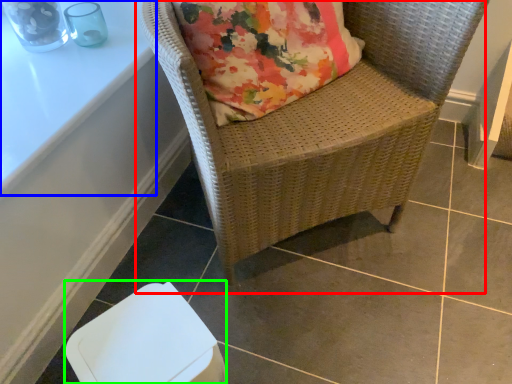
Question: Considering the real-world distances, which object is farthest from chair (highlighted by a red box)? table (highlighted by a blue box) or swivel chair (highlighted by a green box)?

Choices:
 (A) table
 (B) swivel chair

Answer: (A)